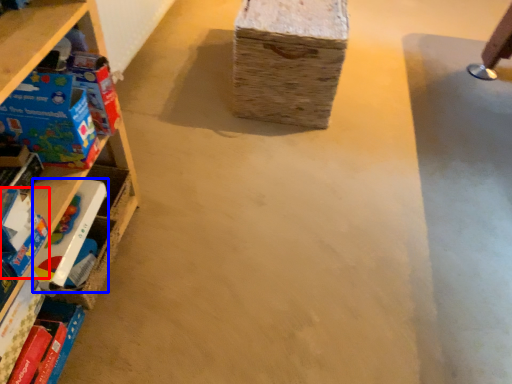
Question: Which object is further to the camera taking this photo, toy (highlighted by a red box) or toy (highlighted by a blue box)?

Choices:
 (A) toy
 (B) toy

Answer: (B)